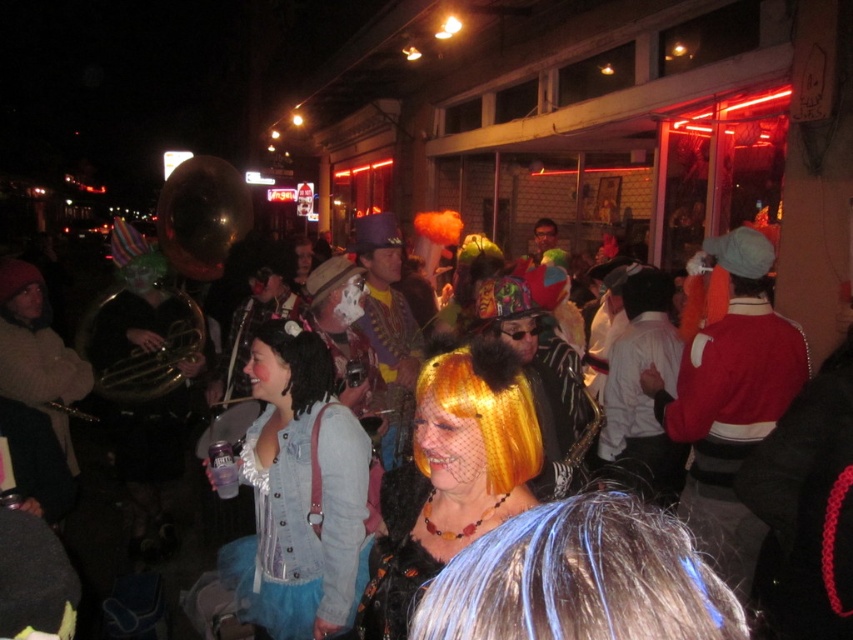
Question: Can you confirm if blue dyed hair at center is thinner than denim jacket at center?

Choices:
 (A) yes
 (B) no

Answer: (A)

Question: Can you confirm if red velvet jacket at right is wider than dreadlocks at center?

Choices:
 (A) no
 (B) yes

Answer: (B)

Question: Which point is farther from the camera taking this photo?

Choices:
 (A) (334, 368)
 (B) (488, 342)
 (C) (257, 563)

Answer: (A)

Question: Which point is farther from the camera taking this photo?

Choices:
 (A) (279, 387)
 (B) (746, 330)

Answer: (B)

Question: Which object is farther from the camera taking this photo?

Choices:
 (A) denim jacket at center
 (B) shiny orange wig at center
 (C) red velvet jacket at right
 (D) shiny gold wig at center

Answer: (C)

Question: Is denim jacket at center wider than shiny gold wig at center?

Choices:
 (A) yes
 (B) no

Answer: (A)